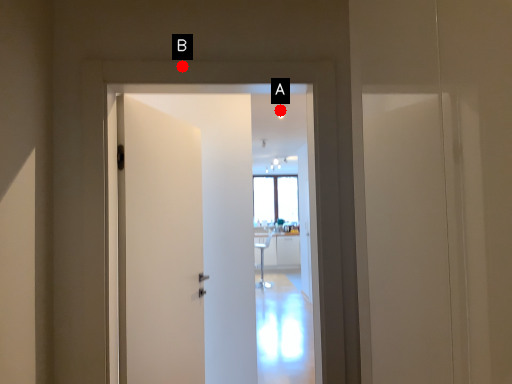
Question: Two points are circled on the image, labeled by A and B beside each circle. Which of the following is the farthest from the observer?

Choices:
 (A) A is further
 (B) B is further

Answer: (A)